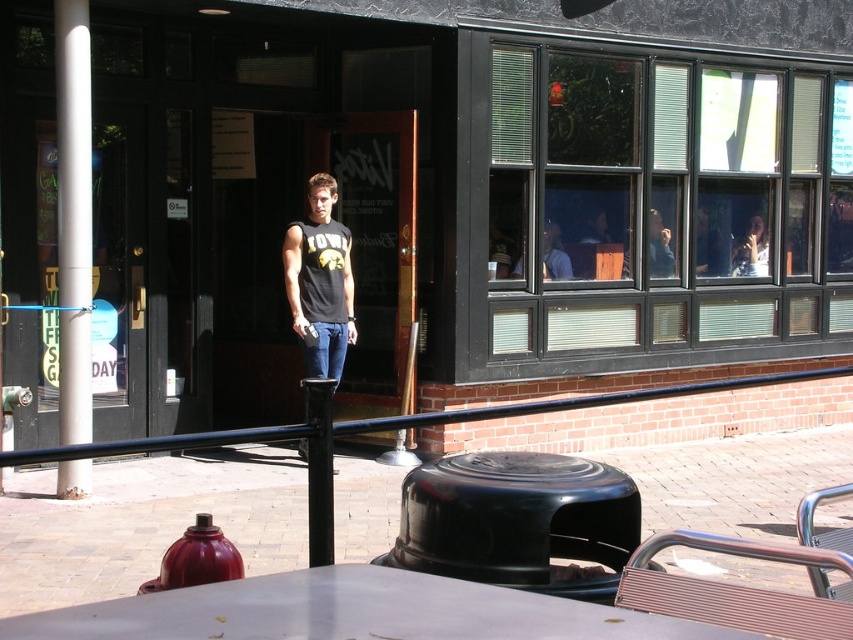
Question: Does white glossy pole at left have a larger size compared to matte black t-shirt at upper center?

Choices:
 (A) yes
 (B) no

Answer: (A)

Question: Which object is the farthest from the white glossy pole at left?

Choices:
 (A) matte black t-shirt at upper center
 (B) shiny red hydrant at lower left
 (C) jeans at center

Answer: (A)

Question: Does white glossy pole at left have a larger size compared to black matte tank top at center?

Choices:
 (A) no
 (B) yes

Answer: (A)

Question: Does black glass storefront at center appear over black matte tank top at center?

Choices:
 (A) no
 (B) yes

Answer: (A)

Question: Which object is closer to the camera taking this photo?

Choices:
 (A) black rubber stool at center
 (B) clear glass window at upper center

Answer: (A)

Question: Among these objects, which one is nearest to the camera?

Choices:
 (A) clear glass window at upper center
 (B) jeans at center
 (C) black rubber stool at center

Answer: (C)